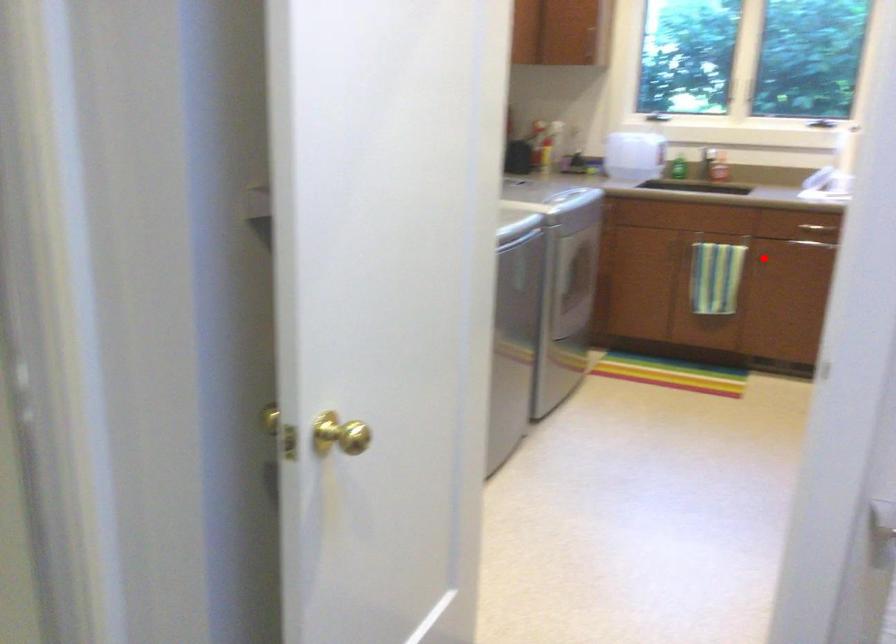
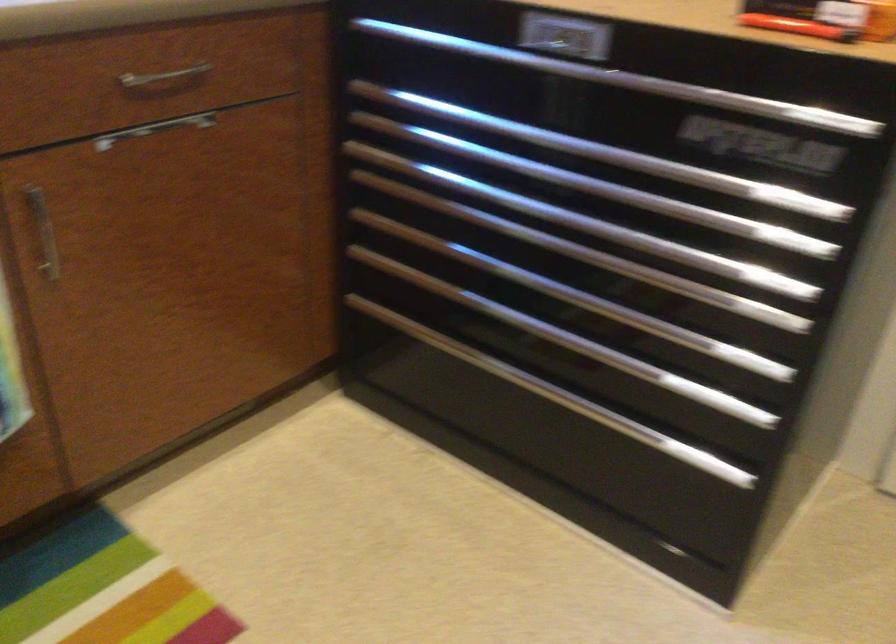
Question: A red point is marked in image1. In image2, is the corresponding 3D point closer to the camera or farther? Reply with the corresponding letter.

Choices:
 (A) The corresponding 3D point is closer.
 (B) The corresponding 3D point is farther.

Answer: (A)